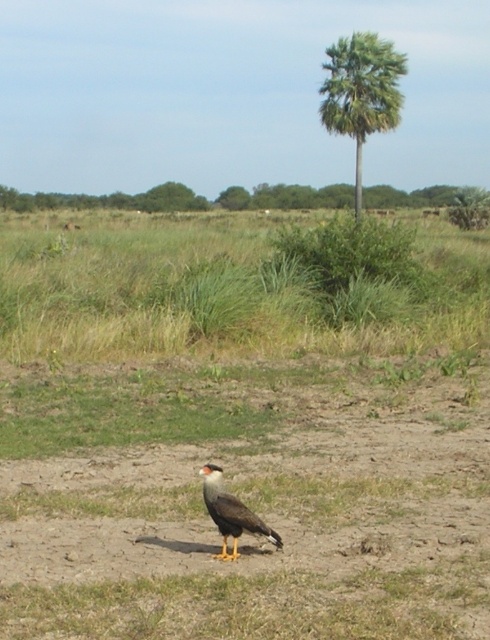
You are a hiker trying to locate the brown feathered eagle at center in the image. From your vantage point, where would you look relative to the green leafy tree at upper center?

The green leafy tree at upper center is positioned on the left side of the brown feathered eagle at center, so you should look to the right of the green leafy tree at upper center to find the brown feathered eagle at center.

You are a birdwatcher standing at the lower left corner of the image. You want to fly directly to the green leafy tree at upper center. What direction should you fly in?

You should fly northeast to reach the green leafy tree at upper center because it is located at the upper center of the image, which is northeast from your position at the lower left corner.

You are standing at the point with coordinates point (261,536) and want to walk to the point with coordinates point (117,202). Is the destination point visible from your current position?

Point (117,202) is behind point (261,536), so the destination point is not visible from your current position.